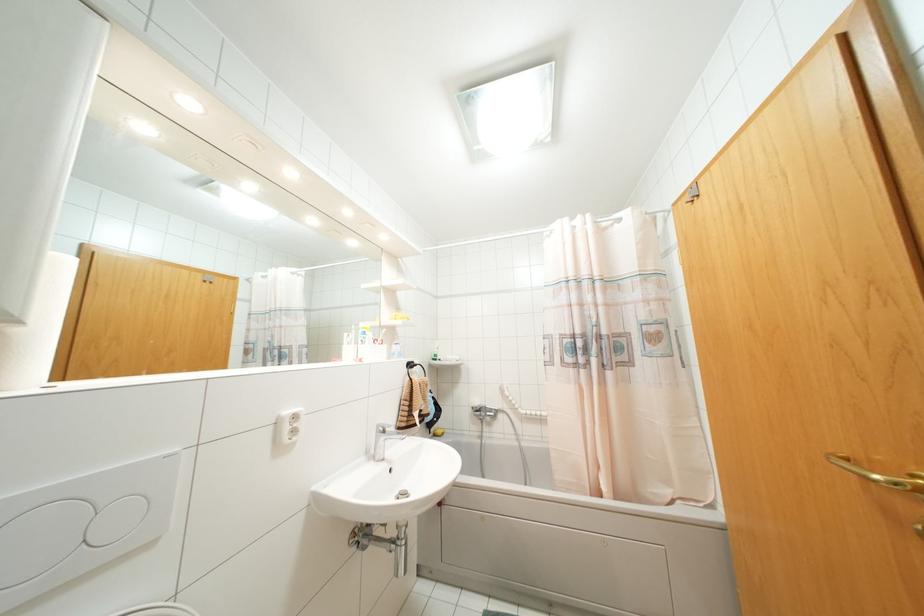
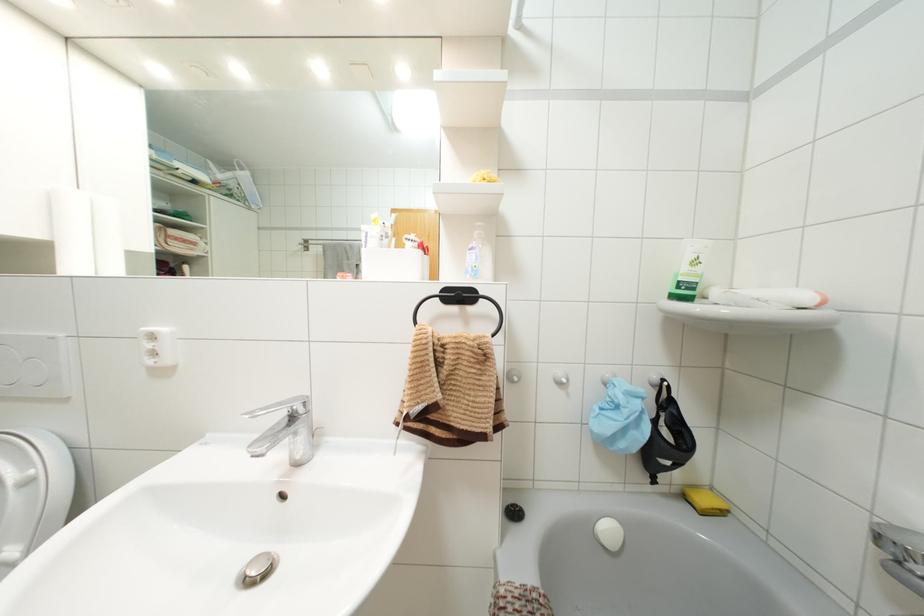
In the second image, find the point that corresponds to (434,435) in the first image.

(685, 496)